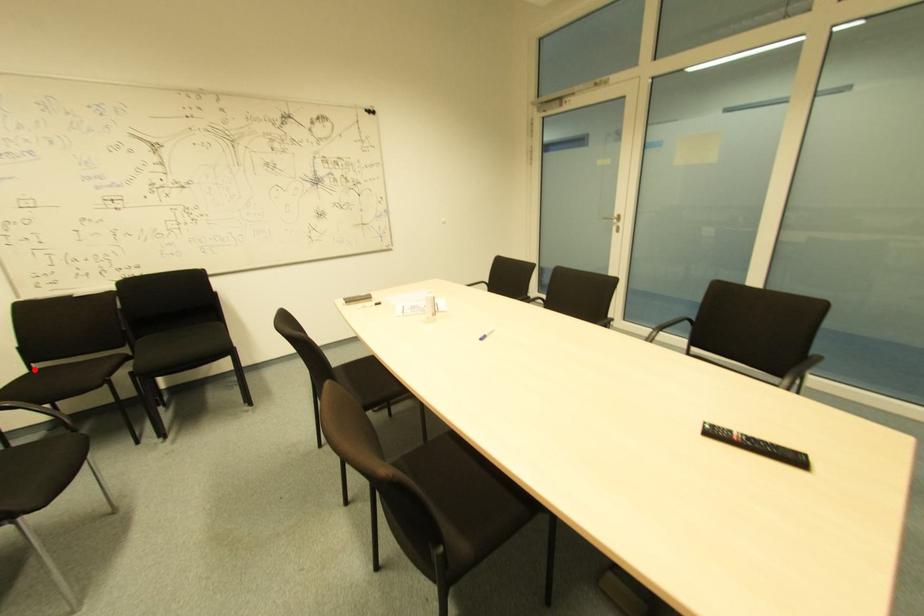
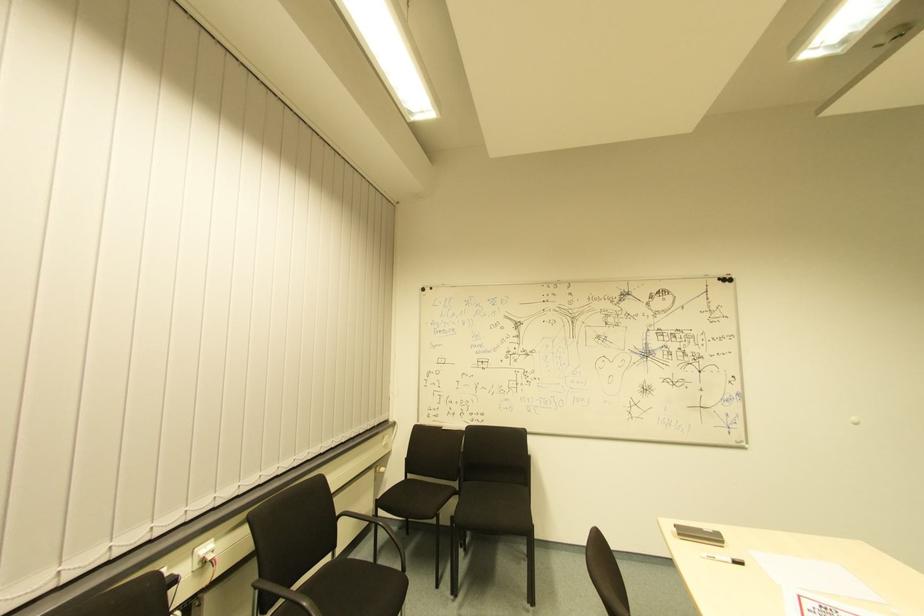
Question: I am providing you with two images of the same scene from different viewpoints. Given a red point in image1, look at the same physical point in image2. Is it:

Choices:
 (A) Closer to the viewpoint
 (B) Farther from the viewpoint

Answer: (A)